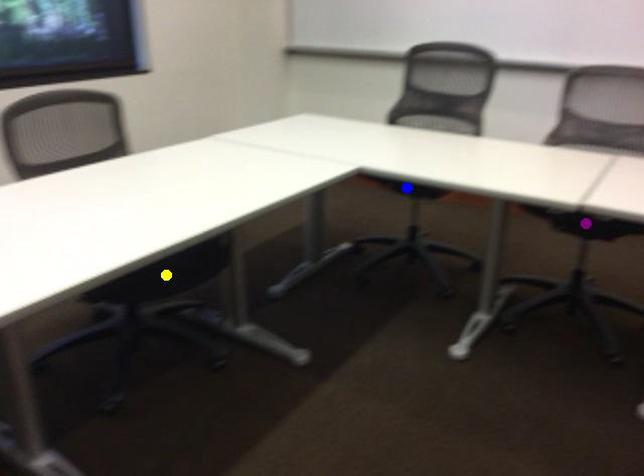
Order these from nearest to farthest:
purple point | yellow point | blue point

yellow point
purple point
blue point